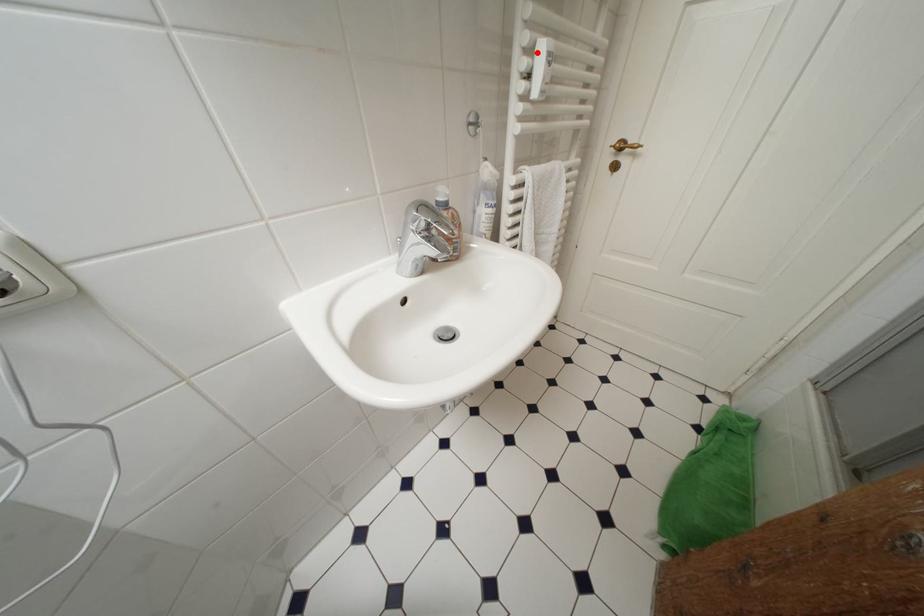
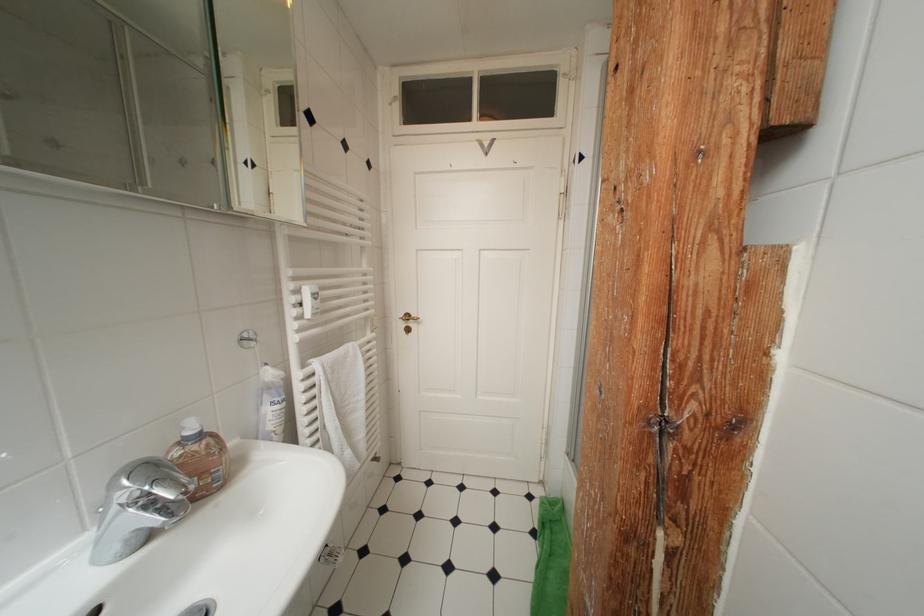
Where in the second image is the point corresponding to the highlighted location from the first image?

(304, 294)